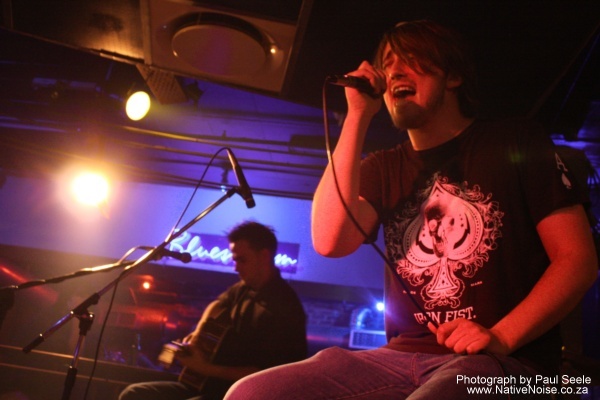
The width and height of the screenshot is (600, 400). What are the coordinates of `light` in the screenshot? It's located at (143, 112), (111, 187).